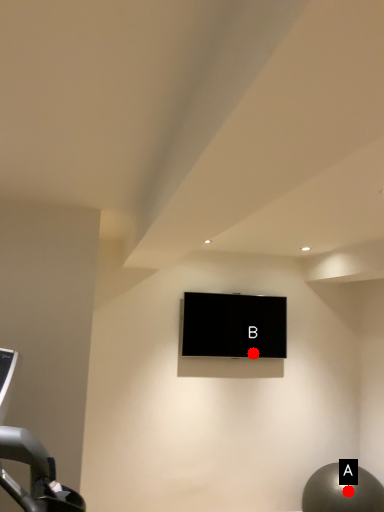
Question: Two points are circled on the image, labeled by A and B beside each circle. Which point appears farthest from the camera in this image?

Choices:
 (A) A is further
 (B) B is further

Answer: (B)